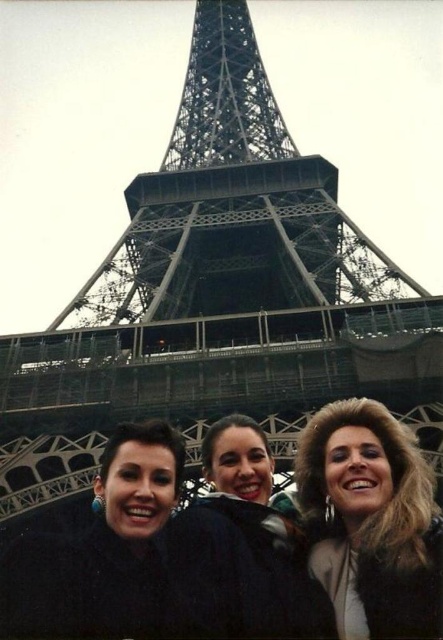
Question: Does fuzzy brown hair at center come behind matte black jacket at center?

Choices:
 (A) no
 (B) yes

Answer: (A)

Question: Is fuzzy brown hair at center smaller than matte black jacket at center?

Choices:
 (A) no
 (B) yes

Answer: (B)

Question: Which point is farther from the camera taking this photo?

Choices:
 (A) (67, 582)
 (B) (263, 627)

Answer: (A)

Question: Based on their relative distances, which object is farther from the matte black jacket at center?

Choices:
 (A) fuzzy brown hair at center
 (B) black fuzzy jacket at lower left

Answer: (A)

Question: Is black fuzzy jacket at lower left below matte black jacket at center?

Choices:
 (A) no
 (B) yes

Answer: (B)

Question: Among these points, which one is farthest from the camera?

Choices:
 (A) (202, 444)
 (B) (345, 540)

Answer: (A)